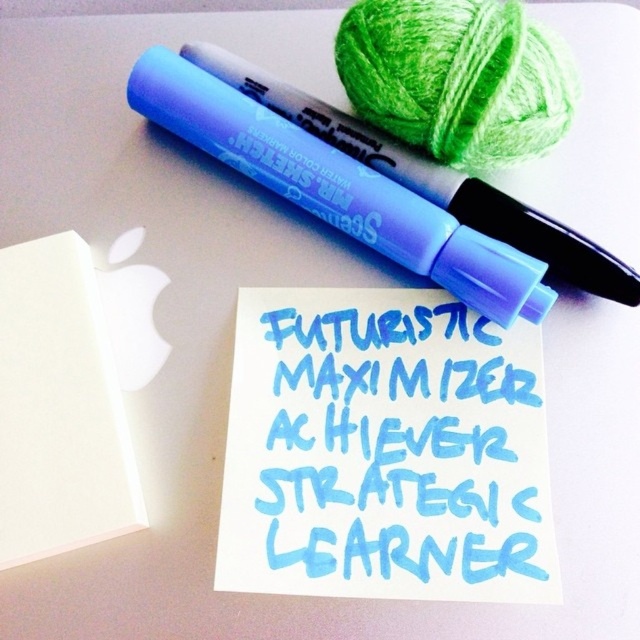
You are organizing your desk and want to place a small plant between the white matte notepad at lower left and the matte blue marker at upper center. Given that the plant requires at least 12 inches of space to grow properly, will there be enough room between them?

The white matte notepad at lower left is 23.28 inches away from the matte blue marker at upper center, so yes, placing the plant between them will provide sufficient space as 23.28 inches is more than the required 12 inches.

You are standing in front of a desk with a blue watercolor text at center. If you want to read the text clearly, should you move closer or farther away from it?

The blue watercolor text at center is 3.66 feet away from viewer. To read it clearly, you should move closer since the text is currently at a distance that might be too far for comfortable reading.

In the scene shown: You are organizing your desk and need to place a new item between the blue watercolor text at center and the white matte notepad at lower left. Where should you place it to ensure it is between them?

Place the new item between the blue watercolor text at center and the white matte notepad at lower left, aligning it horizontally since the blue watercolor text at center is to the right of the white matte notepad at lower left.